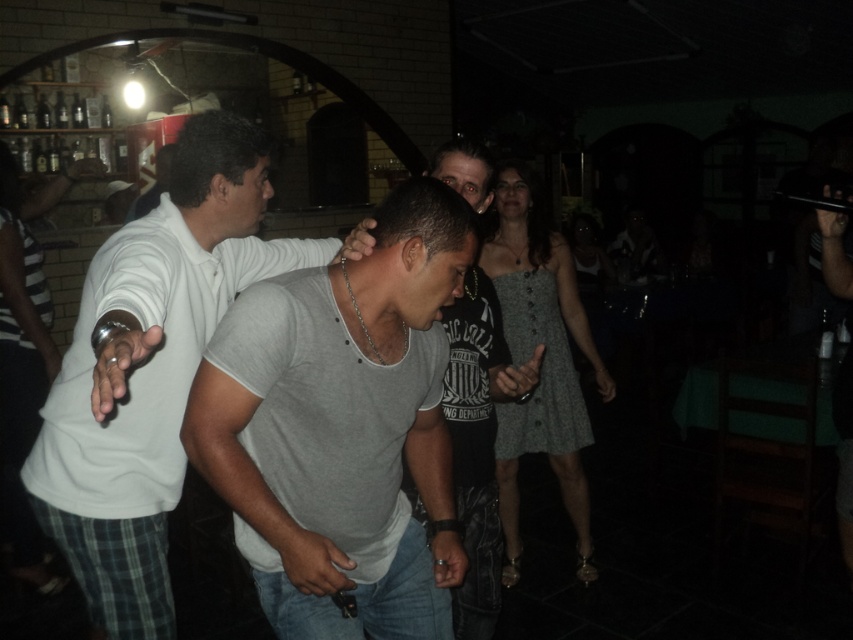
Question: In this image, where is white matte shirt at center located relative to gray cotton t-shirt at center?

Choices:
 (A) left
 (B) right

Answer: (A)

Question: Can you confirm if gray cotton shirt at center is positioned to the right of gray cotton t-shirt at center?

Choices:
 (A) yes
 (B) no

Answer: (B)

Question: Which of the following is the farthest from the observer?

Choices:
 (A) gray cotton shirt at center
 (B) white matte shirt at center
 (C) gray cotton t-shirt at center

Answer: (C)

Question: Estimate the real-world distances between objects in this image. Which object is farther from the gray cotton t-shirt at center?

Choices:
 (A) gray cotton shirt at center
 (B) white matte shirt at center

Answer: (B)

Question: Does white matte shirt at center appear on the right side of gray cotton t-shirt at center?

Choices:
 (A) yes
 (B) no

Answer: (B)

Question: Which object is farther from the camera taking this photo?

Choices:
 (A) white matte shirt at center
 (B) gray cotton t-shirt at center

Answer: (B)